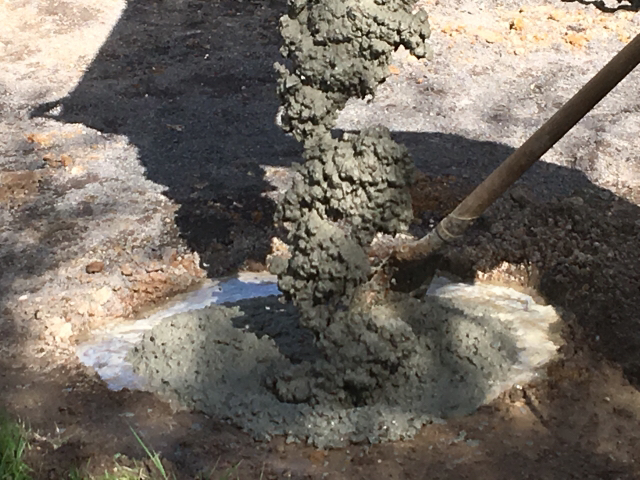
Identify the location of light gray surface. This screenshot has height=480, width=640. (532, 330).